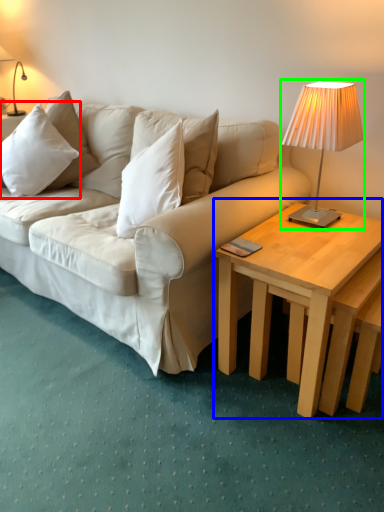
Question: Which object is positioned farthest from pillow (highlighted by a red box)? Select from coffee table (highlighted by a blue box) and lamp (highlighted by a green box).

Choices:
 (A) coffee table
 (B) lamp

Answer: (A)